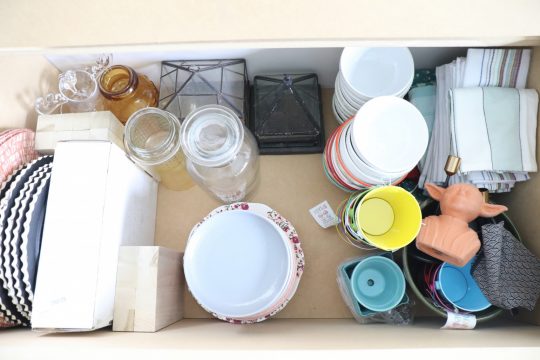
Locate an element on the screen. glass is located at coordinates (211, 178).